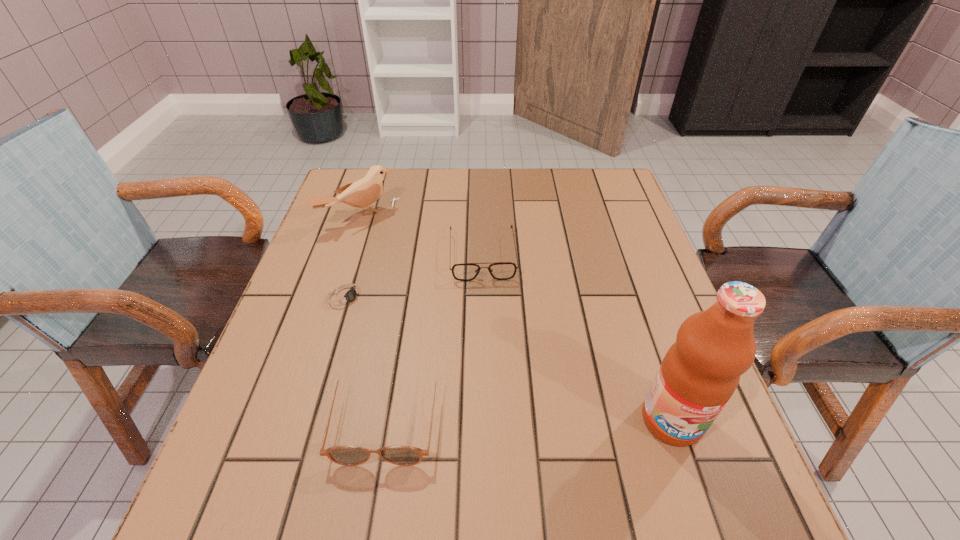
This screenshot has width=960, height=540. I want to click on object that stands as the closest to the shortest object, so click(x=344, y=455).